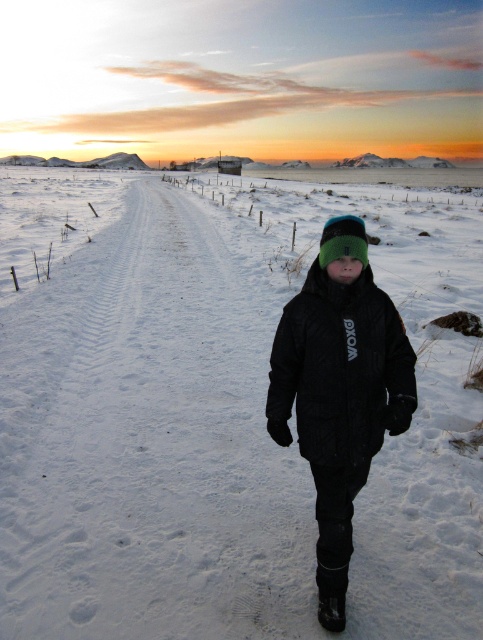
You are a photographer trying to capture the child in the scene. If you want the black quilted jacket at center to appear to the right of the white fluffy snow at center in your photo, where should you position yourself relative to the child?

You should position yourself to the left of the child so that the black quilted jacket at center appears to the right of the white fluffy snow at center in the photo.

You are a photographer trying to capture the child in the winter scene. The child is wearing a green knit hat at center and standing on white fluffy snow at center. Based on their positions, which object is closer to the camera?

The white fluffy snow at center is located above the green knit hat at center, meaning it is closer to the camera than the hat.